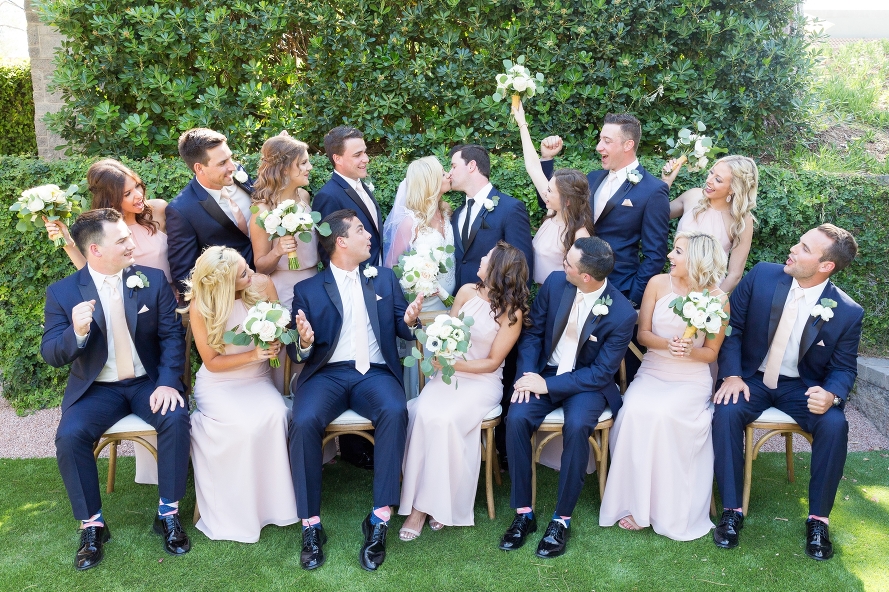
Find the location of a particular element. bouquets is located at coordinates (269, 311), (37, 197), (274, 213), (415, 260), (447, 334), (513, 82), (699, 136), (702, 317).